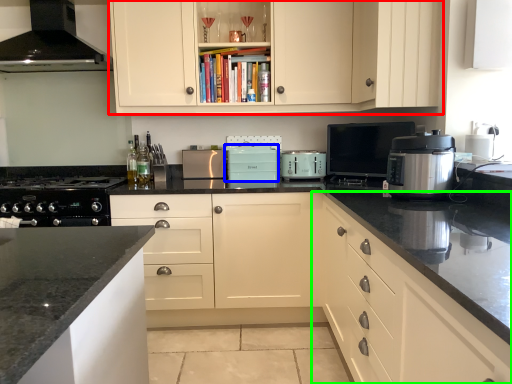
Question: Which object is the closest to the cabinetry (highlighted by a red box)? Choose among these: kitchen appliance (highlighted by a blue box) or cabinetry (highlighted by a green box).

Choices:
 (A) kitchen appliance
 (B) cabinetry

Answer: (A)